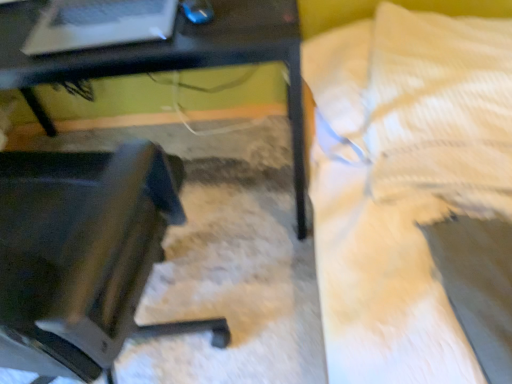
Question: Considering the relative positions of matte black laptop at upper left and black plastic chair at lower left in the image provided, is matte black laptop at upper left to the left of black plastic chair at lower left from the viewer's perspective?

Choices:
 (A) yes
 (B) no

Answer: (A)

Question: Does matte black laptop at upper left come in front of black plastic chair at lower left?

Choices:
 (A) no
 (B) yes

Answer: (B)

Question: Would you say matte black laptop at upper left is a long distance from black plastic chair at lower left?

Choices:
 (A) no
 (B) yes

Answer: (A)

Question: Could you tell me if matte black laptop at upper left is turned towards black plastic chair at lower left?

Choices:
 (A) yes
 (B) no

Answer: (B)

Question: From a real-world perspective, is matte black laptop at upper left positioned over black plastic chair at lower left based on gravity?

Choices:
 (A) no
 (B) yes

Answer: (B)

Question: Is matte black laptop at upper left inside or outside of black plastic table at center?

Choices:
 (A) inside
 (B) outside

Answer: (A)

Question: Based on their positions, is matte black laptop at upper left located to the left or right of black plastic table at center?

Choices:
 (A) right
 (B) left

Answer: (A)

Question: Relative to black plastic table at center, is matte black laptop at upper left in front or behind?

Choices:
 (A) front
 (B) behind

Answer: (B)

Question: From a real-world perspective, is matte black laptop at upper left above or below black plastic table at center?

Choices:
 (A) above
 (B) below

Answer: (A)

Question: Based on their sizes in the image, would you say matte black laptop at upper left is bigger or smaller than black plastic chair at lower left?

Choices:
 (A) small
 (B) big

Answer: (A)

Question: Considering the positions of matte black laptop at upper left and black plastic chair at lower left in the image, is matte black laptop at upper left wider or thinner than black plastic chair at lower left?

Choices:
 (A) wide
 (B) thin

Answer: (B)

Question: Would you say matte black laptop at upper left is inside or outside black plastic chair at lower left?

Choices:
 (A) inside
 (B) outside

Answer: (B)

Question: From the image's perspective, is matte black laptop at upper left positioned above or below black plastic chair at lower left?

Choices:
 (A) below
 (B) above

Answer: (B)

Question: Is white textured bed at upper right in front of or behind matte black laptop at upper left in the image?

Choices:
 (A) front
 (B) behind

Answer: (A)

Question: From the image's perspective, is white textured bed at upper right positioned above or below matte black laptop at upper left?

Choices:
 (A) below
 (B) above

Answer: (A)